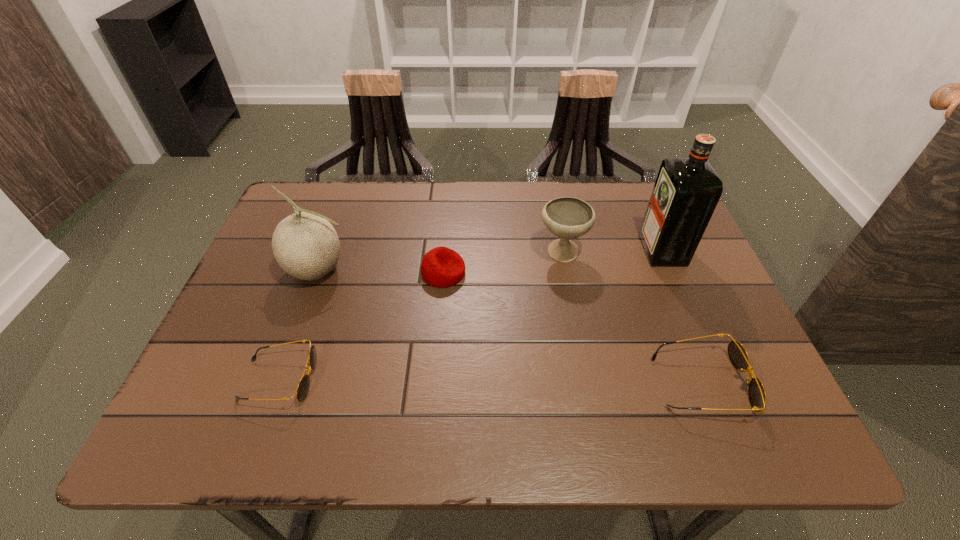
To ensure equal spacing by inserting another sunglasses among them, please point out a vacant spot for this new sunglasses. Please provide its 2D coordinates. Your answer should be formatted as a tuple, i.e. [(x, y)], where the tuple contains the x and y coordinates of a point satisfying the conditions above.

[(490, 381)]